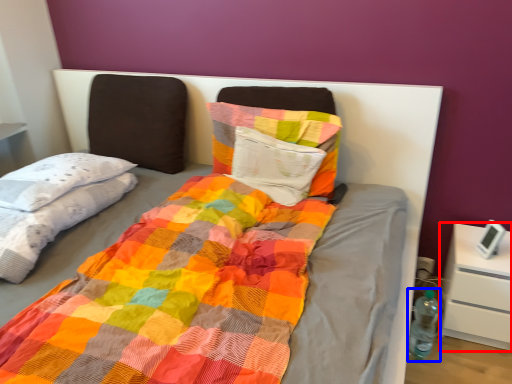
Question: Which object is further to the camera taking this photo, nightstand (highlighted by a red box) or bottle (highlighted by a blue box)?

Choices:
 (A) nightstand
 (B) bottle

Answer: (B)